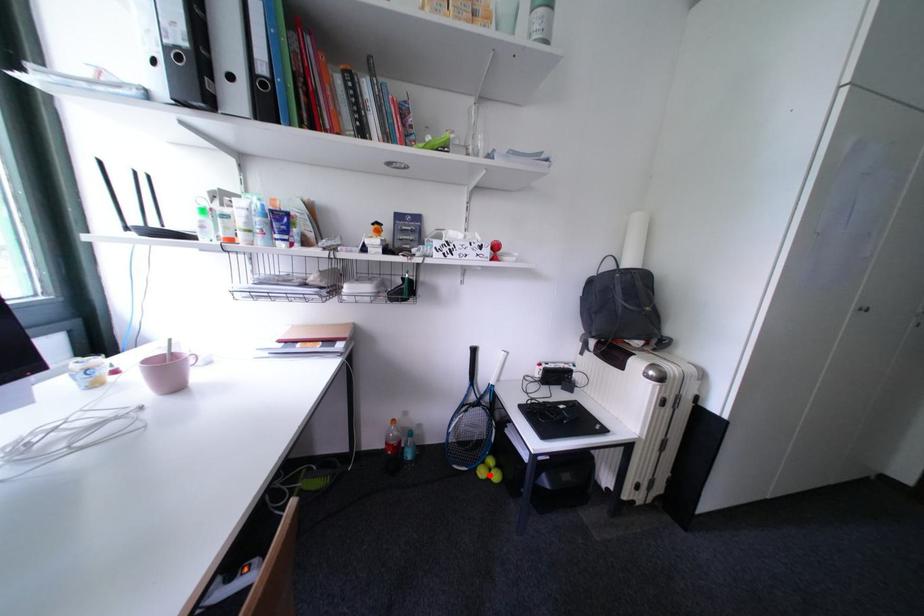
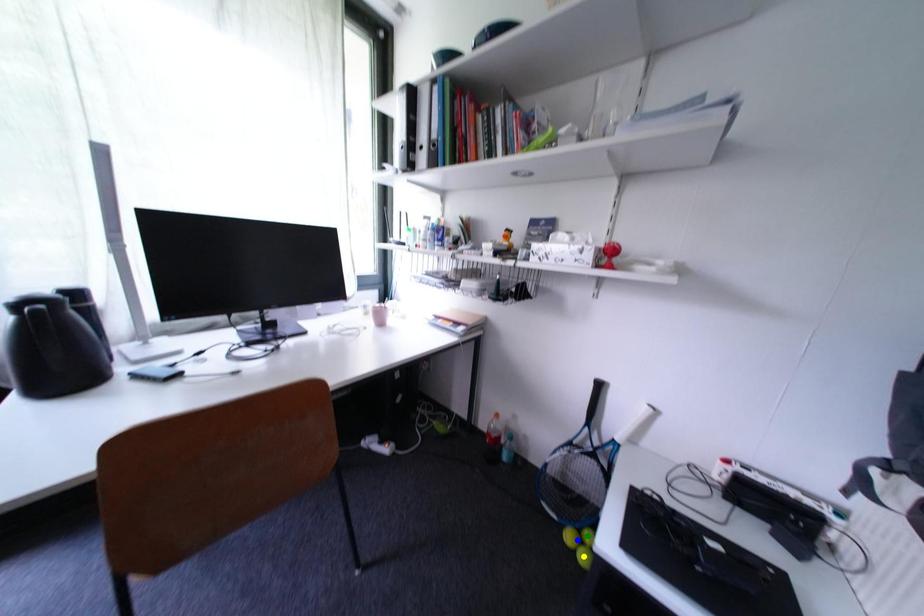
Question: I am providing you with two images of the same scene from different viewpoints. A red point is marked on the first image. You are given multiple points on the second image. Can you choose the point in image 2 that corresponds to the point in image 1?

Choices:
 (A) blue point
 (B) green point
 (C) yellow point

Answer: (A)